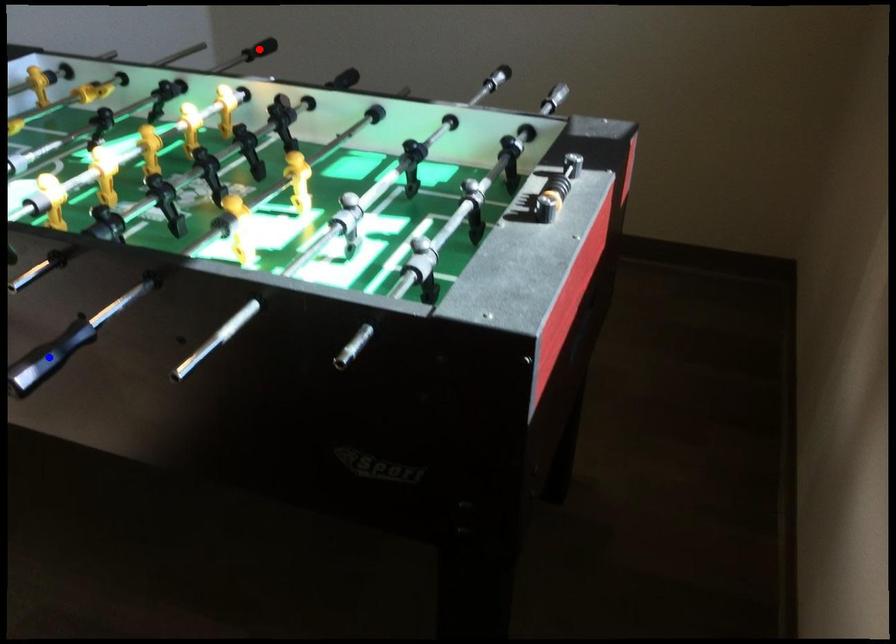
Question: Two points are marked on the image. Which point is closer to the camera?

Choices:
 (A) Blue point is closer.
 (B) Red point is closer.

Answer: (A)